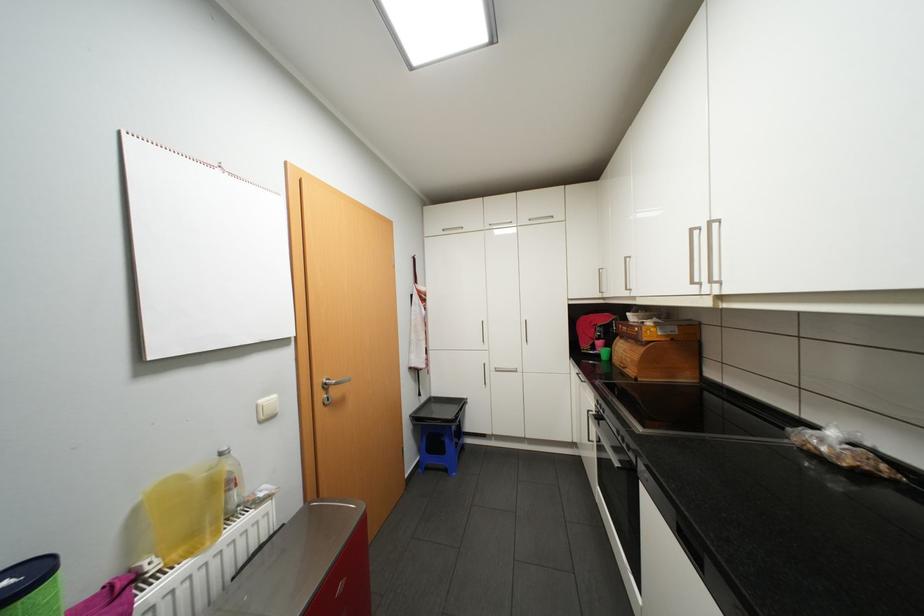
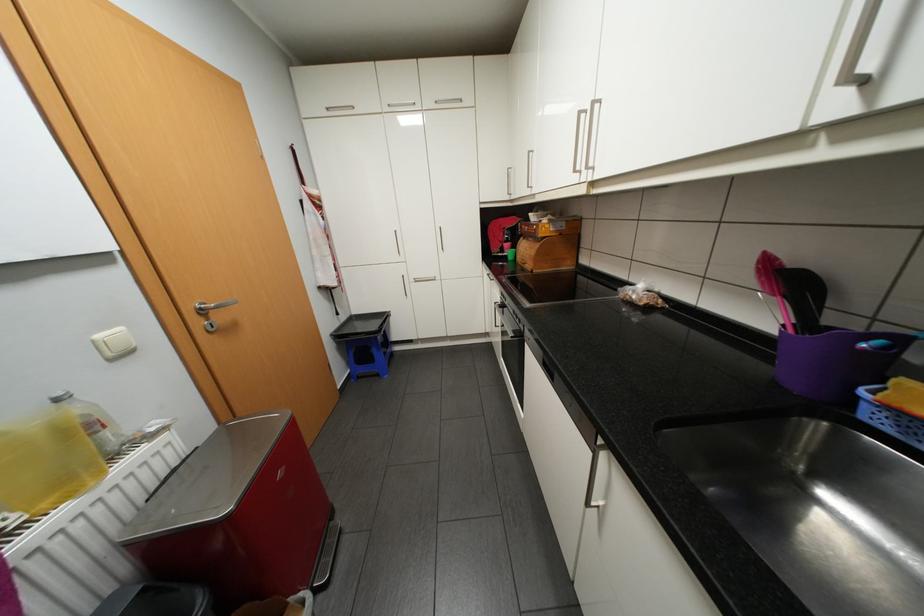
Locate, in the second image, the point that corresponds to point (184, 554) in the first image.

(53, 504)